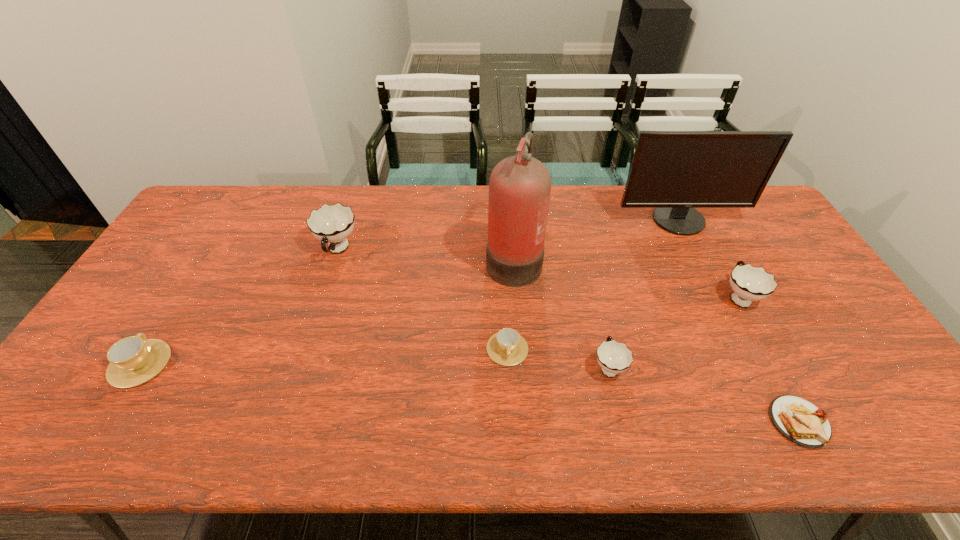
At what (x,y) coordinates should I click in order to perform the action: click on vacant space located 0.290m on the side of the rightmost cup with the handle. Please return your answer as a coordinate pair (x, y). Image resolution: width=960 pixels, height=540 pixels. Looking at the image, I should click on (696, 218).

At what (x,y) coordinates should I click in order to perform the action: click on vacant space located on the side of the rightmost cup with the handle. Please return your answer as a coordinate pair (x, y). The width and height of the screenshot is (960, 540). Looking at the image, I should click on (690, 207).

I want to click on vacant space located on the side of the rightmost cup with the handle, so click(x=716, y=256).

Find the location of a particular element. blank space located on the side of the smallest white cup with the handle is located at coordinates (599, 327).

Where is `free location located 0.090m on the side of the smallest white cup with the handle`? free location located 0.090m on the side of the smallest white cup with the handle is located at coordinates (597, 321).

What are the coordinates of `free space located 0.140m on the side of the smallest white cup with the handle` in the screenshot? It's located at (594, 307).

Where is `vacant position located 0.170m with the handle on the side of the leftmost cup`? The width and height of the screenshot is (960, 540). vacant position located 0.170m with the handle on the side of the leftmost cup is located at coordinates (184, 292).

Where is `vacant region located with the handle on the side of the leftmost cup`? vacant region located with the handle on the side of the leftmost cup is located at coordinates (195, 275).

The width and height of the screenshot is (960, 540). I want to click on free spot located with the handle on the side of the leftmost cup, so click(x=194, y=278).

Find the location of a particular element. The height and width of the screenshot is (540, 960). vacant space located with the handle on the side of the right brown cup is located at coordinates (510, 400).